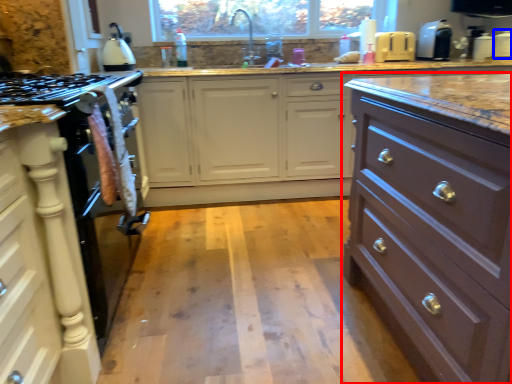
Question: Among these objects, which one is nearest to the camera, chest of drawers (highlighted by a red box) or appliance (highlighted by a blue box)?

Choices:
 (A) chest of drawers
 (B) appliance

Answer: (A)